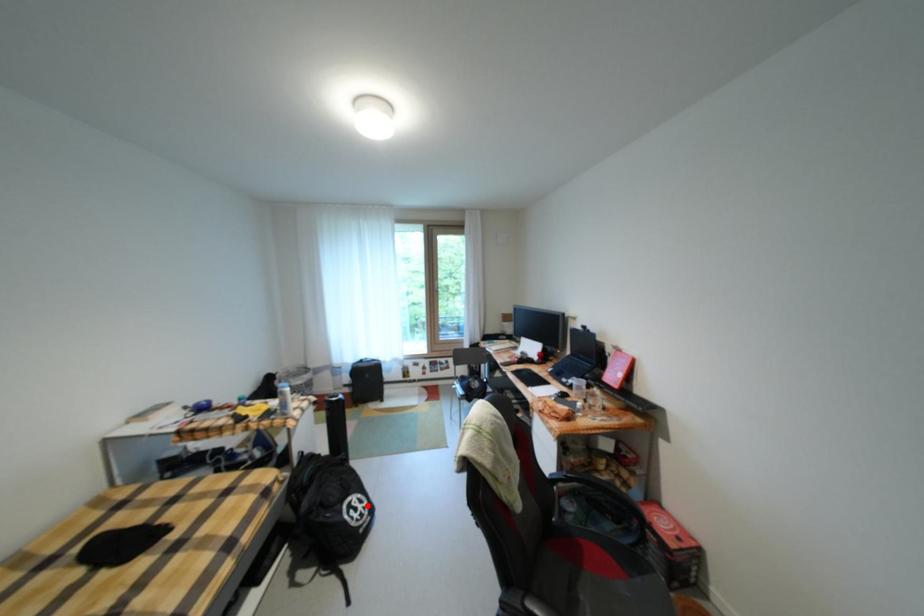
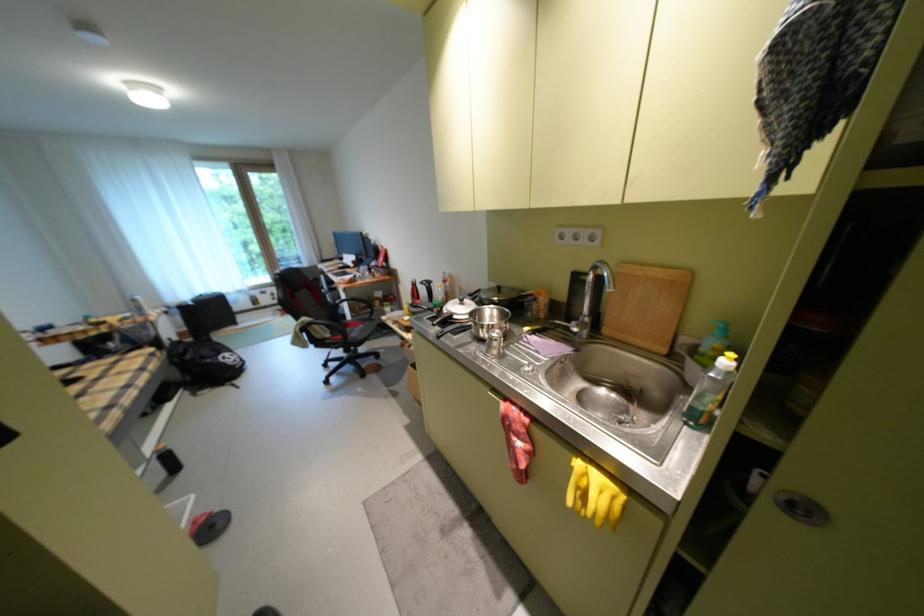
Question: I am providing you with two images of the same scene from different viewpoints. In image1, a red point is highlighted. Considering the same 3D point in image2, which of the following is correct?

Choices:
 (A) It is closer
 (B) It is farther

Answer: (A)